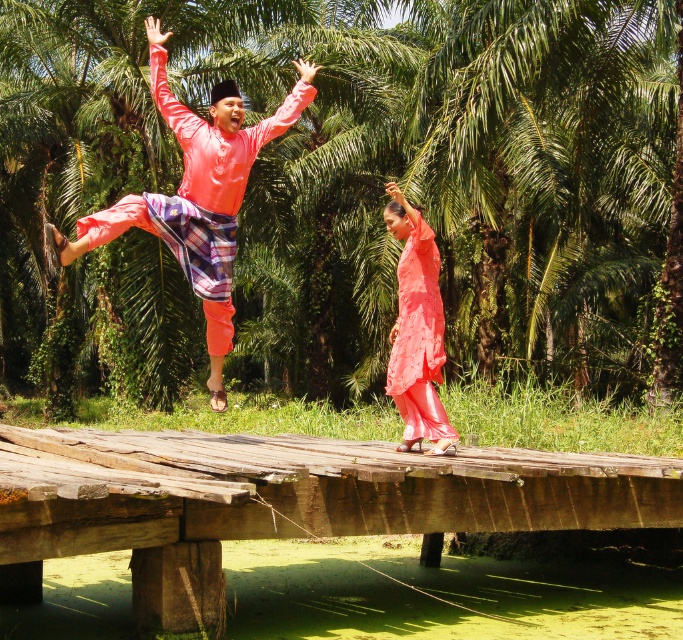
You are standing on the wooden bridge and want to move from the point at coordinates point [320,241] to the point at coordinates point [436,410]. Which direction should you move to reach the second point?

Since point [320,241] is behind point [436,410], you should move forward to reach the second point.

You are a photographer standing on the wooden bridge and want to capture a photo of the shiny pink shirt at upper center and the green leafy palm tree at upper center. Which object will appear taller in the photo?

The green leafy palm tree at upper center appears taller in the photo because it has a greater height compared to the shiny pink shirt at upper center.

You are a photographer standing on the wooden bridge at center. You want to take a photo of the shiny pink shirt at upper center. Which object in your view is smaller in size?

The wooden bridge at center is smaller than the shiny pink shirt at upper center, so the wooden bridge at center is the smaller object.